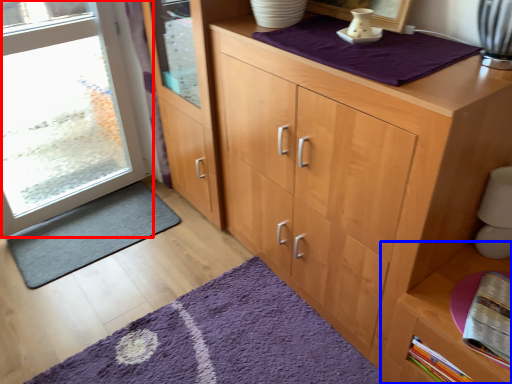
Question: Which object is further to the camera taking this photo, door (highlighted by a red box) or cabinetry (highlighted by a blue box)?

Choices:
 (A) door
 (B) cabinetry

Answer: (A)